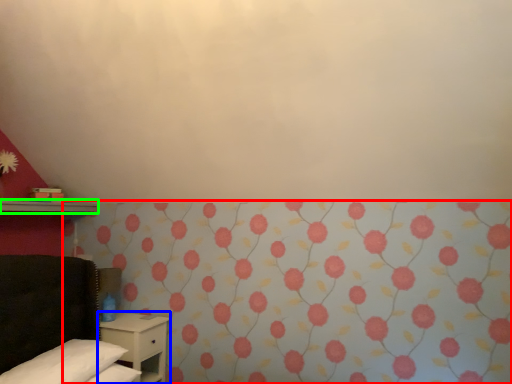
Question: Based on their relative distances, which object is nearer to curtain (highlighted by a red box)? Choose from nightstand (highlighted by a blue box) and shelf (highlighted by a green box).

Choices:
 (A) nightstand
 (B) shelf

Answer: (A)